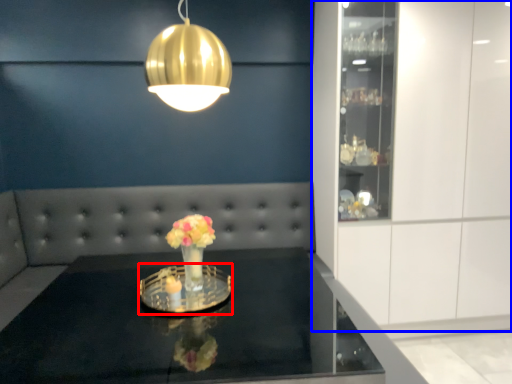
Question: Which of the following is the farthest to the observer, glass plate (highlighted by a red box) or cabinetry (highlighted by a blue box)?

Choices:
 (A) glass plate
 (B) cabinetry

Answer: (B)